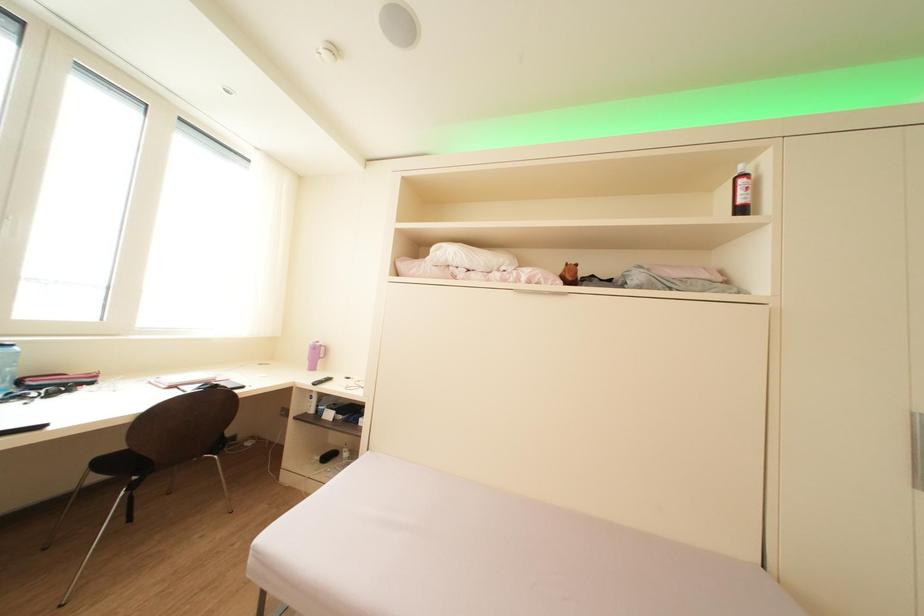
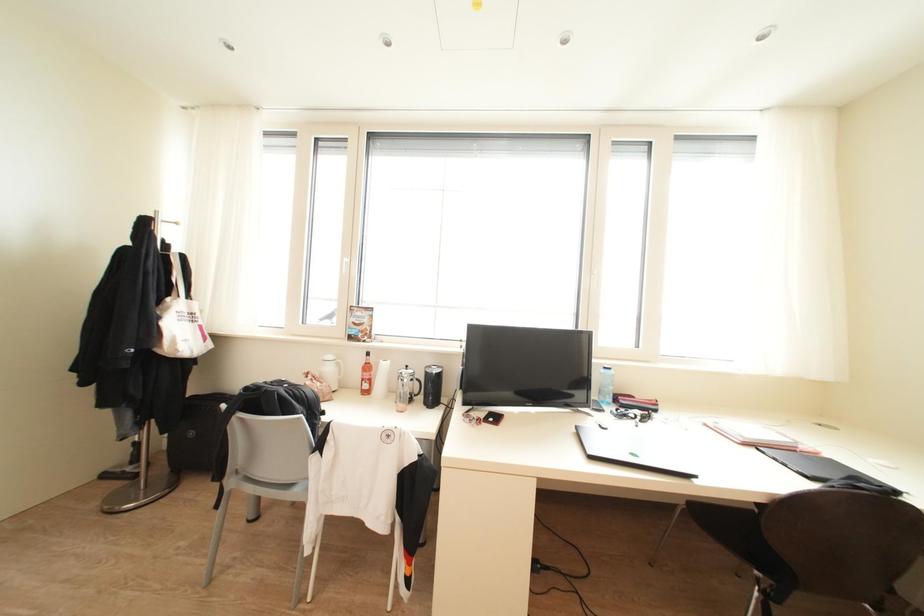
Question: How did the camera likely rotate?

Choices:
 (A) Left
 (B) Right
 (C) Up
 (D) Down

Answer: (A)